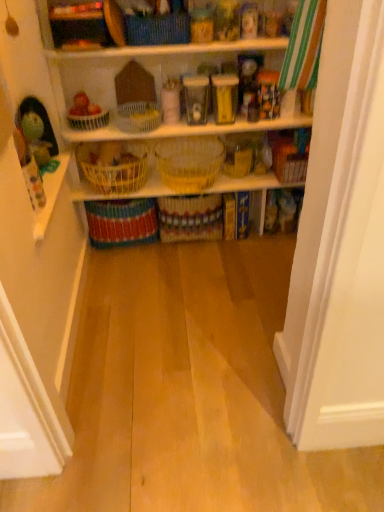
What is the approximate width of yellow wicker baskets at center?

The width of yellow wicker baskets at center is 10.99 inches.

You are a GUI agent. You are given a task and a screenshot of the screen. Output one action in this format:
    pyautogui.click(x=<x>, y=<y>)
    Task: Click on the green plush toy at left
    This screenshot has height=512, width=384.
    Given the screenshot: What is the action you would take?
    pyautogui.click(x=36, y=130)

Is multicolored woven basket at center, which is the first basket in bottom-to-top order, touching green plush toy at left?

multicolored woven basket at center, which is the first basket in bottom-to-top order, is not next to green plush toy at left, and they're not touching.

From the image's perspective, is multicolored woven basket at center, the seventh basket when ordered from top to bottom, above or below green plush toy at left?

Based on their image positions, multicolored woven basket at center, the seventh basket when ordered from top to bottom, is located beneath green plush toy at left.

Is multicolored woven basket at center, which is the first basket in bottom-to-top order, oriented away from green plush toy at left?

No, multicolored woven basket at center, which is the first basket in bottom-to-top order, is not facing away from green plush toy at left.

From the image's perspective, count 6th baskets downward from the woven fabric basket at upper center, placed as the first basket when sorted from top to bottom, and point to it. Please provide its 2D coordinates.

[(122, 222)]

Would you say woven fabric basket at upper center, placed as the first basket when sorted from top to bottom, is outside multicolored woven basket at center, which is the first basket in bottom-to-top order?

Yes, woven fabric basket at upper center, placed as the first basket when sorted from top to bottom, is outside of multicolored woven basket at center, which is the first basket in bottom-to-top order.

In the image, is woven fabric basket at upper center, placed as the first basket when sorted from top to bottom, positioned in front of or behind multicolored woven basket at center, the seventh basket when ordered from top to bottom?

Visually, woven fabric basket at upper center, placed as the first basket when sorted from top to bottom, is located in front of multicolored woven basket at center, the seventh basket when ordered from top to bottom.

Would you consider woven fabric basket at upper center, marked as the 7th basket in a bottom-to-top arrangement, to be distant from multicolored woven basket at center, the seventh basket when ordered from top to bottom?

woven fabric basket at upper center, marked as the 7th basket in a bottom-to-top arrangement, is actually quite close to multicolored woven basket at center, the seventh basket when ordered from top to bottom.

How many degrees apart are the facing directions of white wicker basket at center, the third basket when ordered from top to bottom, and white woven basket at upper left, arranged as the second basket when viewed from the top?

white wicker basket at center, the third basket when ordered from top to bottom, and white woven basket at upper left, arranged as the second basket when viewed from the top, are facing 0.000421 degrees away from each other.

Is white wicker basket at center, the third basket when ordered from top to bottom, far away from white woven basket at upper left, the sixth basket from the bottom?

No, white wicker basket at center, the third basket when ordered from top to bottom, is not far away from white woven basket at upper left, the sixth basket from the bottom.

From a real-world perspective, which is physically above, white wicker basket at center, the third basket when ordered from top to bottom, or white woven basket at upper left, arranged as the second basket when viewed from the top?

white woven basket at upper left, arranged as the second basket when viewed from the top.

Looking at their sizes, would you say white wicker basket at center, positioned as the fifth basket in bottom-to-top order, is wider or thinner than white woven basket at upper left, arranged as the second basket when viewed from the top?

white wicker basket at center, positioned as the fifth basket in bottom-to-top order, is wider than white woven basket at upper left, arranged as the second basket when viewed from the top.

Considering the sizes of objects white wicker basket at center, the third basket when ordered from top to bottom, and yellow woven basket at center, the sixth basket viewed from the top, in the image provided, who is thinner, white wicker basket at center, the third basket when ordered from top to bottom, or yellow woven basket at center, the sixth basket viewed from the top,?

Thinner between the two is white wicker basket at center, the third basket when ordered from top to bottom.

From the image's perspective, is white wicker basket at center, the third basket when ordered from top to bottom, on yellow woven basket at center, which appears as the second basket when ordered from the bottom?

Yes, from the image's perspective, white wicker basket at center, the third basket when ordered from top to bottom, is above yellow woven basket at center, which appears as the second basket when ordered from the bottom.

You are a GUI agent. You are given a task and a screenshot of the screen. Output one action in this format:
    pyautogui.click(x=<x>, y=<y>)
    Task: Click on the basket that is the 3rd object directly below the white wicker basket at center, the third basket when ordered from top to bottom (from a real-world perspective)
    The width and height of the screenshot is (384, 512).
    Given the screenshot: What is the action you would take?
    pyautogui.click(x=190, y=218)

In the image, is white wicker basket at center, the third basket when ordered from top to bottom, positioned in front of or behind yellow woven basket at center, the sixth basket viewed from the top?

Visually, white wicker basket at center, the third basket when ordered from top to bottom, is located in front of yellow woven basket at center, the sixth basket viewed from the top.

Which object is positioned more to the left, yellow wicker baskets at center or white wicker basket at center, the third basket when ordered from top to bottom?

From the viewer's perspective, white wicker basket at center, the third basket when ordered from top to bottom, appears more on the left side.

Is yellow wicker baskets at center not close to white wicker basket at center, positioned as the fifth basket in bottom-to-top order?

No, yellow wicker baskets at center is in close proximity to white wicker basket at center, positioned as the fifth basket in bottom-to-top order.

Is point (147, 169) positioned before point (119, 125)?

No, (147, 169) is further to viewer.

From the image's perspective, is yellow wicker baskets at center located above or below white wicker basket at center, positioned as the fifth basket in bottom-to-top order?

Clearly, from the image's perspective, yellow wicker baskets at center is below white wicker basket at center, positioned as the fifth basket in bottom-to-top order.

Between yellow woven basket at center, which appears as the second basket when ordered from the bottom, and yellow wicker basket at center, which is the 5th basket from top to bottom, which one has larger size?

yellow woven basket at center, which appears as the second basket when ordered from the bottom.

Does yellow woven basket at center, the sixth basket viewed from the top, turn towards yellow wicker basket at center, which is the 5th basket from top to bottom?

No, yellow woven basket at center, the sixth basket viewed from the top, is not turned towards yellow wicker basket at center, which is the 5th basket from top to bottom.

From a real-world perspective, which object stands above the other?

yellow wicker basket at center, which is the 5th basket from top to bottom, from a real-world perspective.

From a real-world perspective, which basket is the 1st one above the yellow woven basket at center, the sixth basket viewed from the top? Please provide its 2D coordinates.

[(113, 170)]

Considering the positions of objects woven yellow basket at center, which is the fourth basket in bottom-to-top order, and yellow wicker baskets at center in the image provided, who is behind, woven yellow basket at center, which is the fourth basket in bottom-to-top order, or yellow wicker baskets at center?

yellow wicker baskets at center is further from the camera.

From the image's perspective, is woven yellow basket at center, marked as the fourth basket in a top-to-bottom arrangement, located beneath yellow wicker baskets at center?

No, from the image's perspective, woven yellow basket at center, marked as the fourth basket in a top-to-bottom arrangement, is not beneath yellow wicker baskets at center.

Consider the image. From a real-world perspective, which is physically above, woven yellow basket at center, marked as the fourth basket in a top-to-bottom arrangement, or yellow wicker baskets at center?

woven yellow basket at center, marked as the fourth basket in a top-to-bottom arrangement.

Can you tell me how much woven yellow basket at center, which is the fourth basket in bottom-to-top order, and yellow wicker baskets at center differ in facing direction?

0.341 degrees separate the facing orientations of woven yellow basket at center, which is the fourth basket in bottom-to-top order, and yellow wicker baskets at center.

This screenshot has height=512, width=384. What are the coordinates of `toy above the multicolored woven basket at center, which is the first basket in bottom-to-top order (from the image's perspective)` in the screenshot? It's located at (36, 130).

Image resolution: width=384 pixels, height=512 pixels. Identify the location of the 3rd basket to the right of the multicolored woven basket at center, which is the first basket in bottom-to-top order, counting from the anchor's position. (157, 29).

Estimate the real-world distances between objects in this image. Which object is further from yellow wicker basket at center, the third basket in the bottom-to-top sequence, multicolored woven basket at center, which is the first basket in bottom-to-top order, or yellow woven basket at center, which appears as the second basket when ordered from the bottom?

Based on the image, yellow woven basket at center, which appears as the second basket when ordered from the bottom, appears to be further to yellow wicker basket at center, the third basket in the bottom-to-top sequence.

When comparing their distances from woven fabric basket at upper center, marked as the 7th basket in a bottom-to-top arrangement, does woven yellow basket at center, which is the fourth basket in bottom-to-top order, or green plush toy at left seem further?

The object further to woven fabric basket at upper center, marked as the 7th basket in a bottom-to-top arrangement, is woven yellow basket at center, which is the fourth basket in bottom-to-top order.

Estimate the real-world distances between objects in this image. Which object is further from white wicker basket at center, the third basket when ordered from top to bottom, yellow wicker baskets at center or woven yellow basket at center, which is the fourth basket in bottom-to-top order?

The object further to white wicker basket at center, the third basket when ordered from top to bottom, is woven yellow basket at center, which is the fourth basket in bottom-to-top order.

Estimate the real-world distances between objects in this image. Which object is closer to multicolored woven basket at center, which is the first basket in bottom-to-top order, white wicker basket at center, positioned as the fifth basket in bottom-to-top order, or white woven basket at upper left, arranged as the second basket when viewed from the top?

white wicker basket at center, positioned as the fifth basket in bottom-to-top order, lies closer to multicolored woven basket at center, which is the first basket in bottom-to-top order, than the other object.

Considering their positions, is yellow wicker basket at center, which is the 5th basket from top to bottom, positioned further to yellow wicker baskets at center than multicolored woven basket at center, which is the first basket in bottom-to-top order?

multicolored woven basket at center, which is the first basket in bottom-to-top order.

Considering their positions, is green plush toy at left positioned further to yellow wicker basket at center, which is the 5th basket from top to bottom, than woven yellow basket at center, marked as the fourth basket in a top-to-bottom arrangement?

The object further to yellow wicker basket at center, which is the 5th basket from top to bottom, is green plush toy at left.

Consider the image. Which object lies further to the anchor point yellow wicker basket at center, which is the 5th basket from top to bottom, multicolored woven basket at center, which is the first basket in bottom-to-top order, or woven fabric basket at upper center, placed as the first basket when sorted from top to bottom?

Among the two, woven fabric basket at upper center, placed as the first basket when sorted from top to bottom, is located further to yellow wicker basket at center, which is the 5th basket from top to bottom.

Which object lies further to the anchor point green plush toy at left, white wicker basket at center, positioned as the fifth basket in bottom-to-top order, or yellow wicker baskets at center?

yellow wicker baskets at center.

I want to click on shelf between woven fabric basket at upper center, placed as the first basket when sorted from top to bottom, and yellow woven basket at center, which appears as the second basket when ordered from the bottom, vertically, so click(132, 191).

Where is `shelf that lies between white wicker basket at center, the third basket when ordered from top to bottom, and yellow woven basket at center, the sixth basket viewed from the top, from top to bottom`? Image resolution: width=384 pixels, height=512 pixels. shelf that lies between white wicker basket at center, the third basket when ordered from top to bottom, and yellow woven basket at center, the sixth basket viewed from the top, from top to bottom is located at coordinates (132, 191).

I want to click on basket between woven fabric basket at upper center, placed as the first basket when sorted from top to bottom, and white wicker basket at center, the third basket when ordered from top to bottom, from top to bottom, so click(x=88, y=120).

Identify the location of shelf between woven fabric basket at upper center, placed as the first basket when sorted from top to bottom, and multicolored woven basket at center, which is the first basket in bottom-to-top order, vertically. (132, 191).